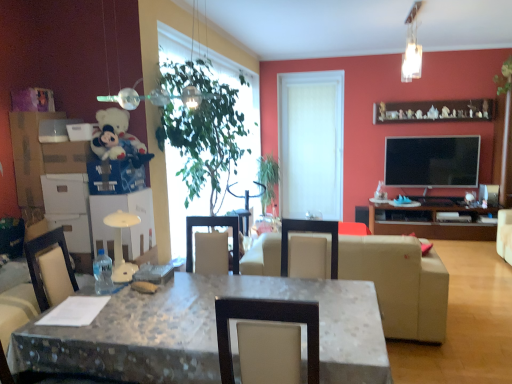
Question: Is green leafy plant at upper right, the first plant positioned from the front, smaller than green leafy plant at center?

Choices:
 (A) yes
 (B) no

Answer: (A)

Question: Can you confirm if green leafy plant at upper right, the second plant in the bottom-to-top sequence, is positioned to the left of green leafy plant at center?

Choices:
 (A) no
 (B) yes

Answer: (A)

Question: Is green leafy plant at center located within green leafy plant at upper right, the first plant positioned from the front?

Choices:
 (A) no
 (B) yes

Answer: (A)

Question: Would you say green leafy plant at upper right, the 2th plant viewed from the left, is outside green leafy plant at center?

Choices:
 (A) no
 (B) yes

Answer: (B)

Question: Is green leafy plant at upper right, marked as the second plant in a back-to-front arrangement, far away from green leafy plant at center?

Choices:
 (A) yes
 (B) no

Answer: (A)

Question: Considering the relative positions of white matte door at center and clear plastic bottle at table center in the image provided, is white matte door at center to the left or to the right of clear plastic bottle at table center?

Choices:
 (A) right
 (B) left

Answer: (A)

Question: Relative to clear plastic bottle at table center, is white matte door at center in front or behind?

Choices:
 (A) front
 (B) behind

Answer: (B)

Question: Looking at their shapes, would you say white matte door at center is wider or thinner than clear plastic bottle at table center?

Choices:
 (A) wide
 (B) thin

Answer: (B)

Question: Considering the positions of point (339, 195) and point (105, 256), is point (339, 195) closer or farther from the camera than point (105, 256)?

Choices:
 (A) closer
 (B) farther

Answer: (B)

Question: From a real-world perspective, is brown wooden entertainment center at right physically located above or below metallic blue box at upper left, positioned as the first box in right-to-left order?

Choices:
 (A) below
 (B) above

Answer: (A)

Question: Visually, is brown wooden entertainment center at right positioned to the left or to the right of metallic blue box at upper left, marked as the second box in a left-to-right arrangement?

Choices:
 (A) right
 (B) left

Answer: (A)

Question: In terms of height, does brown wooden entertainment center at right look taller or shorter compared to metallic blue box at upper left, positioned as the first box in right-to-left order?

Choices:
 (A) short
 (B) tall

Answer: (B)

Question: Based on their sizes in the image, would you say brown wooden entertainment center at right is bigger or smaller than metallic blue box at upper left, marked as the second box in a left-to-right arrangement?

Choices:
 (A) big
 (B) small

Answer: (A)

Question: Is green leafy plant at upper right, the first plant positioned from the front, bigger or smaller than green leafy plant at center, which is the 2th plant from top to bottom?

Choices:
 (A) small
 (B) big

Answer: (A)

Question: Looking at their shapes, would you say green leafy plant at upper right, marked as the second plant in a back-to-front arrangement, is wider or thinner than green leafy plant at center, positioned as the second plant in front-to-back order?

Choices:
 (A) thin
 (B) wide

Answer: (A)